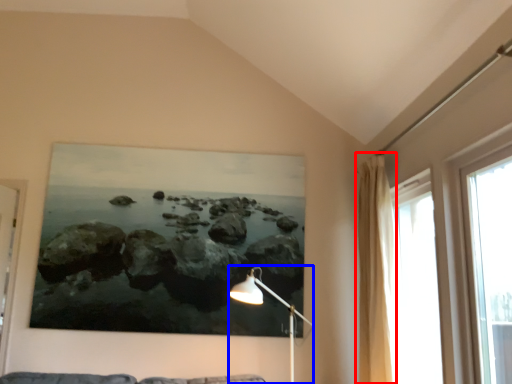
Question: Among these objects, which one is farthest to the camera, curtain (highlighted by a red box) or table lamp (highlighted by a blue box)?

Choices:
 (A) curtain
 (B) table lamp

Answer: (A)